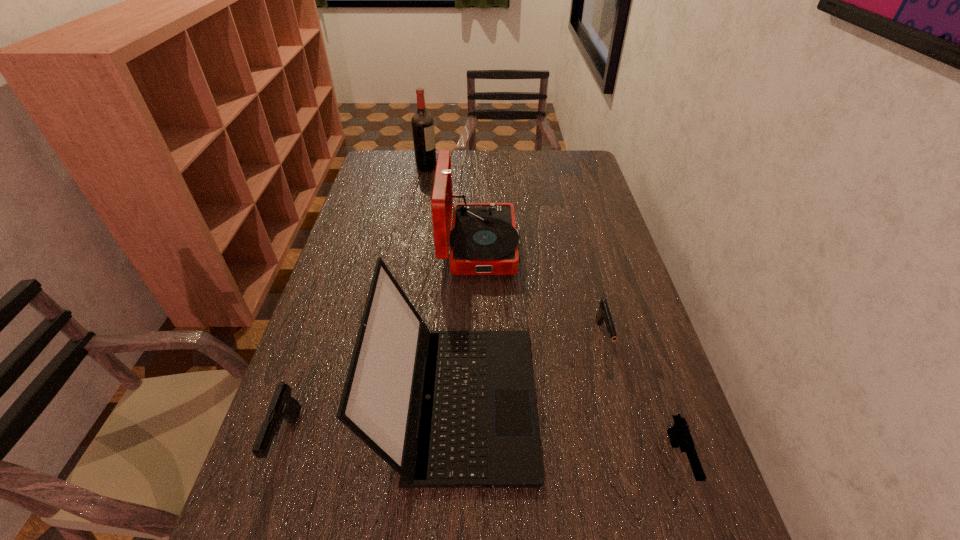
You are a GUI agent. You are given a task and a screenshot of the screen. Output one action in this format:
    pyautogui.click(x=<x>, y=<y>)
    Task: Click on the free point between the leftmost pistol and the liquor
    The image size is (960, 540).
    Given the screenshot: What is the action you would take?
    pyautogui.click(x=357, y=303)

Locate an element on the screen. Image resolution: width=960 pixels, height=540 pixels. empty location between the rightmost pistol and the farthest object is located at coordinates (553, 313).

Where is `free area in between the laptop and the rightmost pistol`? This screenshot has width=960, height=540. free area in between the laptop and the rightmost pistol is located at coordinates (568, 430).

The image size is (960, 540). Find the location of `the fifth closest object to the farthest object`. the fifth closest object to the farthest object is located at coordinates (679, 434).

You are a GUI agent. You are given a task and a screenshot of the screen. Output one action in this format:
    pyautogui.click(x=<x>, y=<y>)
    Task: Click on the object that is the third closest to the tallest pistol
    The width and height of the screenshot is (960, 540).
    Given the screenshot: What is the action you would take?
    point(603,315)

Identify the location of the third closest pistol to the phonograph_record. Image resolution: width=960 pixels, height=540 pixels. (679, 434).

Locate an element on the screen. The width and height of the screenshot is (960, 540). pistol that stands as the second closest to the fifth nearest object is located at coordinates (282, 405).

At what (x,y) coordinates should I click in order to perform the action: click on vacant space that satisfies the following two spatial constraints: 1. on the front-facing side of the liquor; 2. aim along the barrel of the third shortest object. Please return your answer as a coordinate pair (x, y). Looking at the image, I should click on (378, 439).

The width and height of the screenshot is (960, 540). In order to click on vacant region that satisfies the following two spatial constraints: 1. at the muzzle of the farthest pistol; 2. on the surface of the laptop in this screenshot , I will do `click(620, 401)`.

This screenshot has width=960, height=540. Find the location of `free space in the image that satisfies the following two spatial constraints: 1. on the surface of the laptop; 2. aim along the barrel of the leftmost object`. free space in the image that satisfies the following two spatial constraints: 1. on the surface of the laptop; 2. aim along the barrel of the leftmost object is located at coordinates (456, 439).